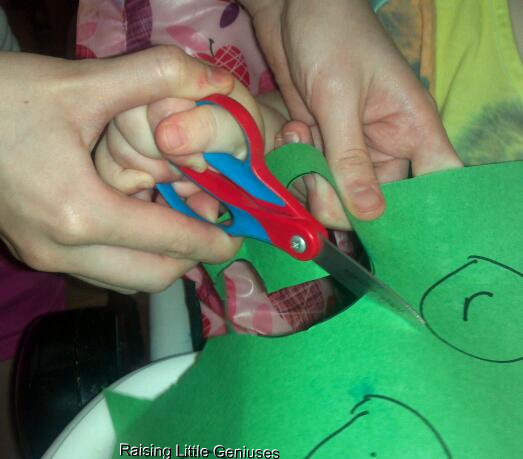
Find the location of a particular element. The width and height of the screenshot is (523, 459). green felt is located at coordinates (469, 234).